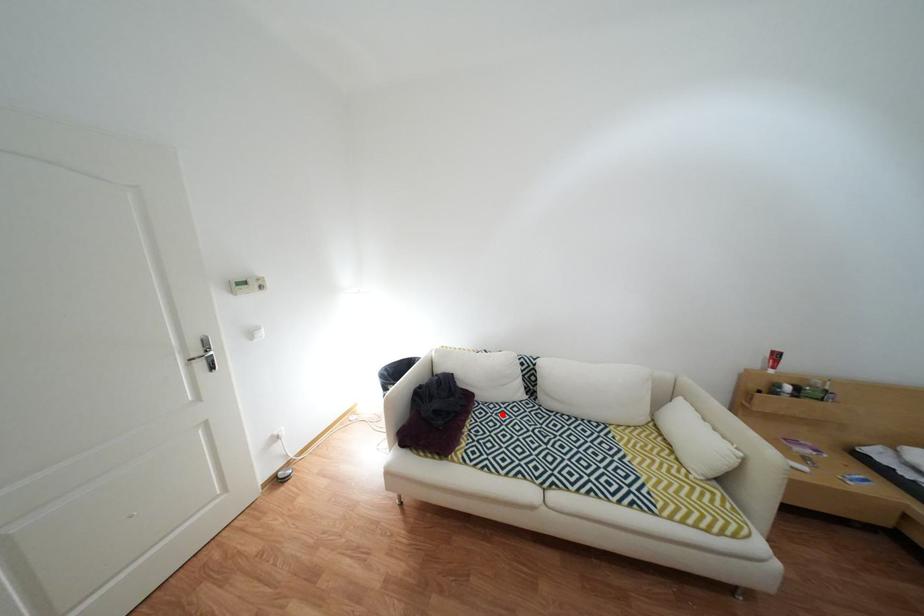
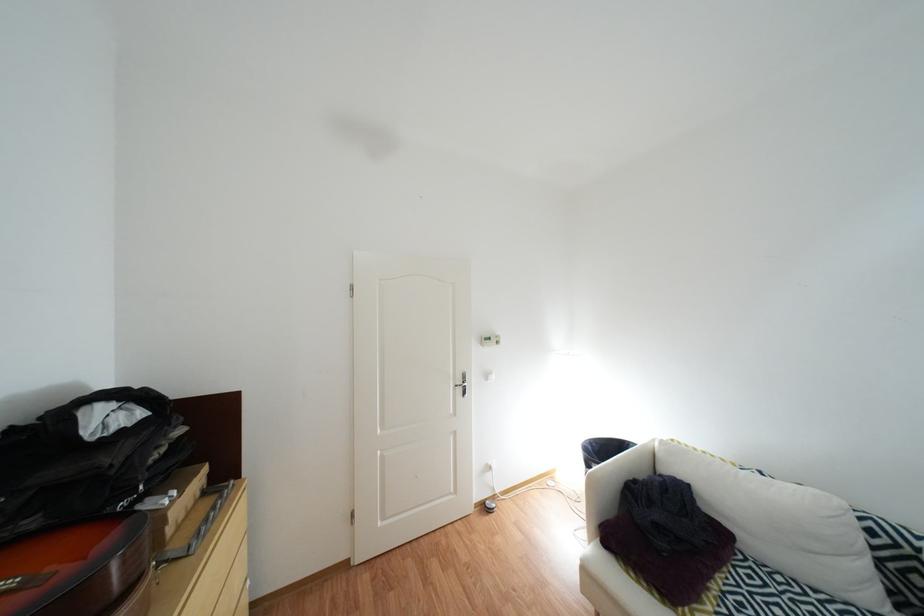
The point at the highlighted location is marked in the first image. Where is the corresponding point in the second image?

(782, 586)